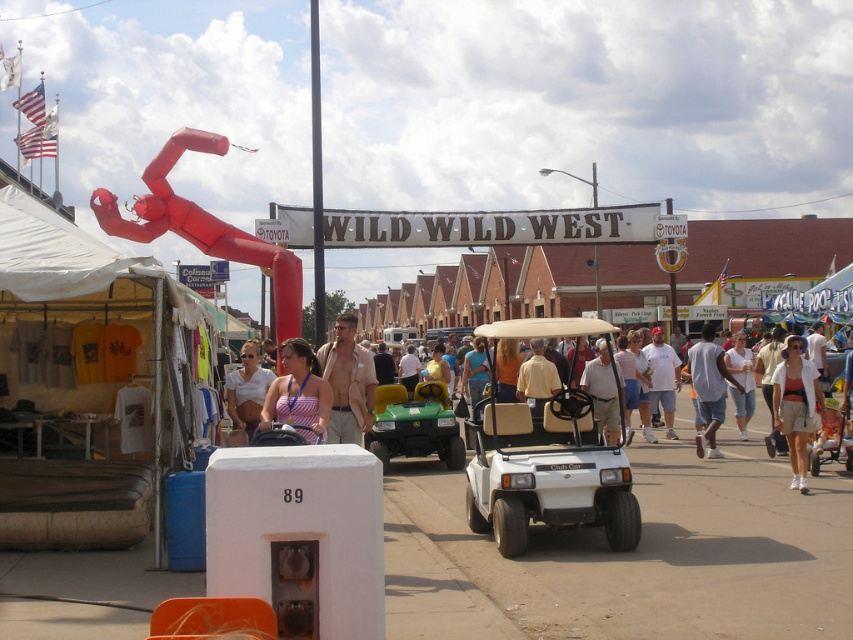
Question: Where is white matte golf cart at center located in relation to denim shorts at center in the image?

Choices:
 (A) above
 (B) below

Answer: (A)

Question: Is the position of striped fabric tank top at center more distant than that of denim shorts at center?

Choices:
 (A) yes
 (B) no

Answer: (B)

Question: Which point appears farthest from the camera in this image?

Choices:
 (A) (294, 368)
 (B) (700, 406)
 (C) (796, 394)
 (D) (527, 477)

Answer: (B)

Question: Which point appears farthest from the camera in this image?

Choices:
 (A) (721, 349)
 (B) (476, 433)

Answer: (A)

Question: From the image, what is the correct spatial relationship of denim shorts at center in relation to light blue denim shorts at center?

Choices:
 (A) below
 (B) above

Answer: (A)

Question: Estimate the real-world distances between objects in this image. Which object is closer to the light blue denim shorts at center?

Choices:
 (A) green matte golf cart at center
 (B) matte white tank top at center

Answer: (A)